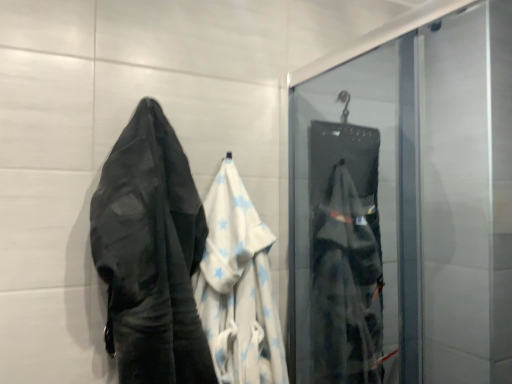
Describe the element at coordinates (238, 287) in the screenshot. The height and width of the screenshot is (384, 512). I see `white cotton towel at center` at that location.

Where is `white cotton towel at left`? This screenshot has height=384, width=512. white cotton towel at left is located at coordinates (151, 254).

This screenshot has height=384, width=512. What do you see at coordinates (356, 221) in the screenshot? I see `matte black bag at right` at bounding box center [356, 221].

You are a GUI agent. You are given a task and a screenshot of the screen. Output one action in this format:
    pyautogui.click(x=<x>, y=<y>)
    Task: Click on the white cotton towel at center
    
    Given the screenshot: What is the action you would take?
    pyautogui.click(x=238, y=287)

From the image's perspective, is white cotton towel at left below matte black bag at right?

Incorrect, from the image's perspective, white cotton towel at left is higher than matte black bag at right.

Can you confirm if white cotton towel at left is shorter than matte black bag at right?

Correct, white cotton towel at left is not as tall as matte black bag at right.

From a real-world perspective, is white cotton towel at left positioned over matte black bag at right based on gravity?

Yes, from a real-world perspective, white cotton towel at left is on top of matte black bag at right.

Consider the image. Between white cotton towel at center and white cotton towel at left, which one has smaller width?

white cotton towel at center.

Is white cotton towel at center taller or shorter than white cotton towel at left?

In the image, white cotton towel at center appears to be shorter than white cotton towel at left.

Is white cotton towel at center to the left of white cotton towel at left from the viewer's perspective?

Incorrect, white cotton towel at center is not on the left side of white cotton towel at left.

Considering the positions of objects white cotton towel at center and white cotton towel at left in the image provided, who is behind, white cotton towel at center or white cotton towel at left?

Positioned behind is white cotton towel at center.

From the image's perspective, is white cotton towel at center above or below matte black bag at right?

From the image's perspective, white cotton towel at center appears below matte black bag at right.

Who is taller, white cotton towel at center or matte black bag at right?

Standing taller between the two is matte black bag at right.

Relative to matte black bag at right, is white cotton towel at center in front or behind?

In the image, white cotton towel at center appears in front of matte black bag at right.

Is white cotton towel at center inside the boundaries of matte black bag at right, or outside?

white cotton towel at center cannot be found inside matte black bag at right.

Between white cotton towel at left and white cotton towel at center, which one is positioned in front?

Positioned in front is white cotton towel at left.

Is white cotton towel at left situated inside white cotton towel at center or outside?

white cotton towel at left lies outside white cotton towel at center.

Is there a large distance between white cotton towel at left and white cotton towel at center?

No, white cotton towel at left is not far away from white cotton towel at center.

Is white cotton towel at left to the left or to the right of white cotton towel at center in the image?

From the image, it's evident that white cotton towel at left is to the left of white cotton towel at center.

Is the position of matte black bag at right less distant than that of white cotton towel at left?

That is False.

Where is `towel in front of the matte black bag at right`? towel in front of the matte black bag at right is located at coordinates (151, 254).

Is matte black bag at right far from white cotton towel at left?

No.

Can we say matte black bag at right lies outside white cotton towel at center?

Absolutely, matte black bag at right is external to white cotton towel at center.

Is matte black bag at right looking in the opposite direction of white cotton towel at center?

No, matte black bag at right's orientation is not away from white cotton towel at center.

Which of these two, matte black bag at right or white cotton towel at center, is wider?

matte black bag at right.

Identify the location of screen door on the right of white cotton towel at left. (356, 221).

Identify the location of towel located in front of the white cotton towel at center. The image size is (512, 384). (151, 254).

Estimate the real-world distances between objects in this image. Which object is closer to matte black bag at right, white cotton towel at left or white cotton towel at center?

white cotton towel at center is positioned closer to the anchor matte black bag at right.

Based on their spatial positions, is white cotton towel at center or matte black bag at right further from white cotton towel at left?

Based on the image, matte black bag at right appears to be further to white cotton towel at left.

Based on their spatial positions, is matte black bag at right or white cotton towel at center further from white cotton towel at left?

The object further to white cotton towel at left is matte black bag at right.

When comparing their distances from white cotton towel at center, does white cotton towel at left or matte black bag at right seem further?

Based on the image, matte black bag at right appears to be further to white cotton towel at center.

Looking at the image, which one is located further to white cotton towel at center, matte black bag at right or white cotton towel at left?

Based on the image, matte black bag at right appears to be further to white cotton towel at center.

Based on the photo, from the image, which object appears to be farther from matte black bag at right, white cotton towel at center or white cotton towel at left?

Based on the image, white cotton towel at left appears to be further to matte black bag at right.

The image size is (512, 384). Identify the location of garment located between white cotton towel at left and matte black bag at right in the left-right direction. (238, 287).